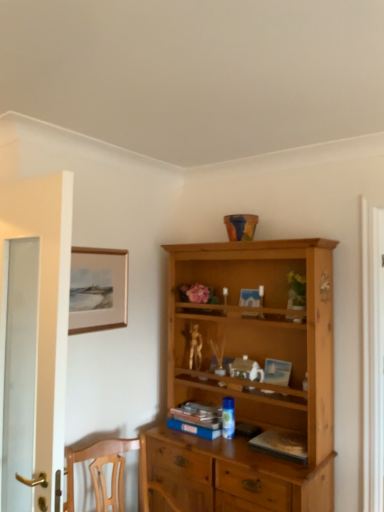
Question: Is hardcover book at center, which is the 2th book from left to right, in contact with gold metallic figurine at center?

Choices:
 (A) yes
 (B) no

Answer: (B)

Question: Is hardcover book at center, acting as the first book starting from the right, closer to camera compared to gold metallic figurine at center?

Choices:
 (A) yes
 (B) no

Answer: (A)

Question: Does hardcover book at center, which is the 2th book from left to right, have a lesser width compared to gold metallic figurine at center?

Choices:
 (A) yes
 (B) no

Answer: (B)

Question: Is hardcover book at center, the 1th book positioned from the front, facing towards gold metallic figurine at center?

Choices:
 (A) no
 (B) yes

Answer: (A)

Question: From a real-world perspective, is hardcover book at center, acting as the first book starting from the right, on top of gold metallic figurine at center?

Choices:
 (A) no
 (B) yes

Answer: (A)

Question: From the image's perspective, does hardcover book at center, the second book from the back, appear lower than gold metallic figurine at center?

Choices:
 (A) no
 (B) yes

Answer: (B)

Question: From a real-world perspective, is hardcover book at center, which is the 2th book from left to right, located beneath blue matte book at center, which is the 2th book from front to back?

Choices:
 (A) no
 (B) yes

Answer: (B)

Question: Considering the relative positions of hardcover book at center, which is the 2th book from left to right, and blue matte book at center, acting as the second book starting from the right, in the image provided, is hardcover book at center, which is the 2th book from left to right, in front of blue matte book at center, acting as the second book starting from the right,?

Choices:
 (A) yes
 (B) no

Answer: (A)

Question: Considering the relative sizes of hardcover book at center, the second book from the back, and blue matte book at center, the first book positioned from the back, in the image provided, is hardcover book at center, the second book from the back, shorter than blue matte book at center, the first book positioned from the back,?

Choices:
 (A) yes
 (B) no

Answer: (A)

Question: Can you confirm if hardcover book at center, the second book from the back, is positioned to the left of blue matte book at center, acting as the second book starting from the right?

Choices:
 (A) yes
 (B) no

Answer: (B)

Question: Could you tell me if hardcover book at center, the 1th book positioned from the front, is turned towards blue matte book at center, acting as the second book starting from the right?

Choices:
 (A) yes
 (B) no

Answer: (B)

Question: Is hardcover book at center, the second book from the back, with white glass door at left?

Choices:
 (A) no
 (B) yes

Answer: (A)